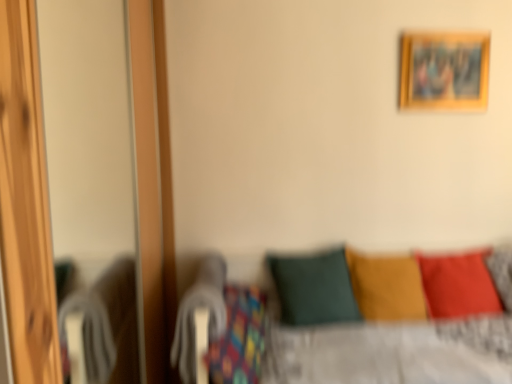
At what (x,y) coordinates should I click in order to perform the action: click on free space above wooden picture frame at upper right (from a real-world perspective). Please return your answer as a coordinate pair (x, y). This screenshot has height=384, width=512. Looking at the image, I should click on (454, 26).